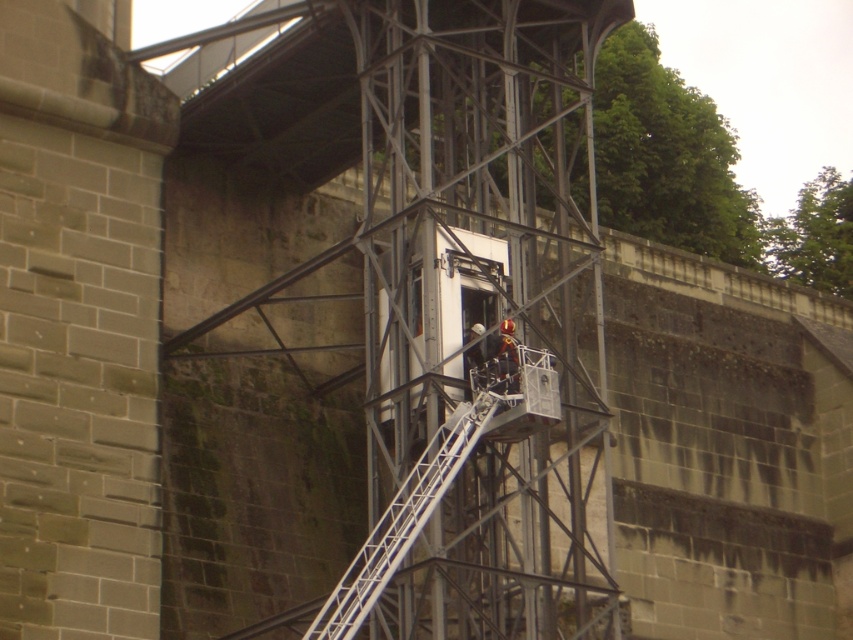
Consider the image. You are standing at the bottom of the scaffolding and want to reach the platform at the top. There is a metallic silver ladder at center. Based on its position, can you estimate if the ladder is directly under the platform or offset to one side?

The metallic silver ladder at center is located at coordinates (x=404, y=518), which places it centrally under the platform, so yes, it is directly under the platform.

You are a construction worker needing to climb down from the scaffolding platform. There is a metallic silver ladder at center and an orange safety helmet at center nearby. How far apart are these two items?

The metallic silver ladder at center is 7.24 meters away from the orange safety helmet at center.